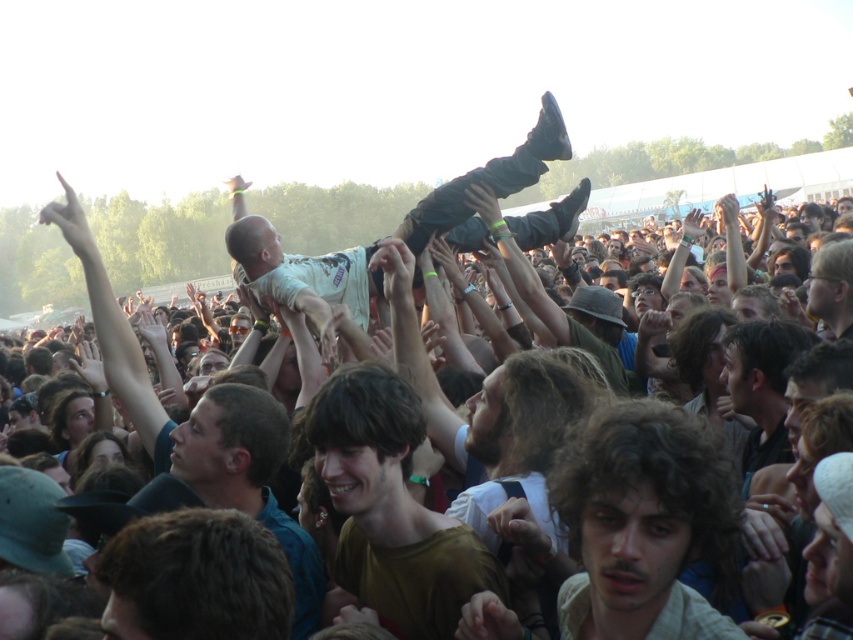
In the music festival scene, where exactly is the brown matte shirt at center located in terms of coordinates?

The brown matte shirt at center is located at point coordinates of (392, 508).

You are a photographer trying to capture the central figure in the crowd. You notice the brown matte shirt at center and the blue shirt at center. Which shirt should you focus on if you want to ensure the central figure is fully visible in your shot?

The brown matte shirt at center might be wider than blue shirt at center, so focusing on the brown matte shirt at center could help ensure the central figure is fully visible as it may cover more of the central figure.

Consider the image. You are a photographer at the music festival, and you want to capture a photo of the central figure being lifted by the crowd. You notice the brown matte shirt at center and the light brown fabric baby at center in your frame. Which object should you adjust your focus to ensure the central figure is properly centered in your shot?

The brown matte shirt at center is to the left of light brown fabric baby at center, so to center the central figure, focus on the light brown fabric baby at center as it is positioned closer to the center of the scene.